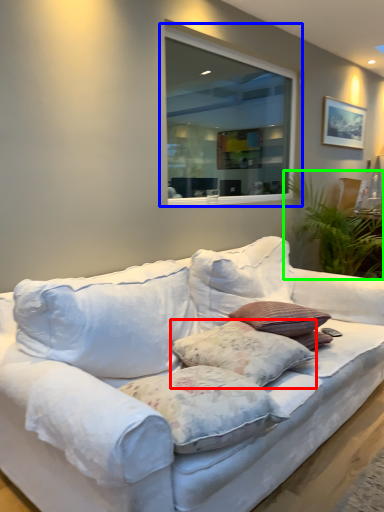
Question: Considering the real-world distances, which object is closest to pillow (highlighted by a red box)? window (highlighted by a blue box) or plant (highlighted by a green box).

Choices:
 (A) window
 (B) plant

Answer: (B)